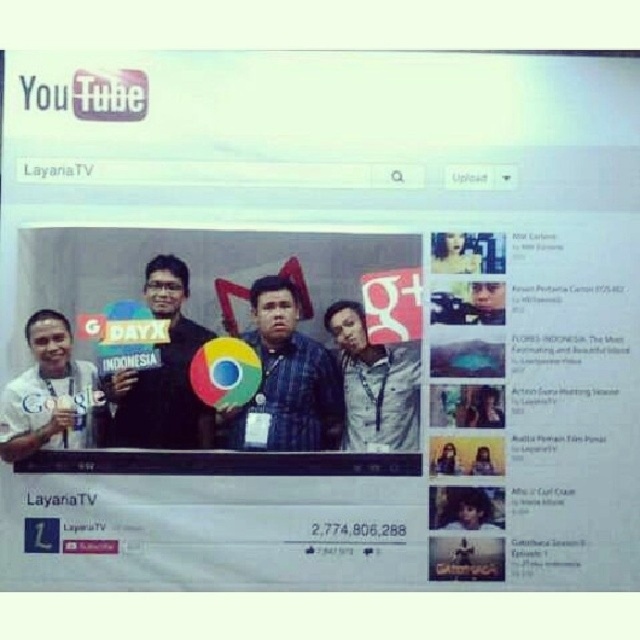
Question: Which object is closer to the camera taking this photo?

Choices:
 (A) white matte shirt at left
 (B) denim jacket at center
 (C) black matte shirt at center
 (D) matte blue shirt at center

Answer: (A)

Question: Is white matte shirt at left smaller than denim jacket at center?

Choices:
 (A) yes
 (B) no

Answer: (B)

Question: Which object is the farthest from the matte blue shirt at center?

Choices:
 (A) black matte shirt at center
 (B) denim jacket at center

Answer: (A)

Question: Can you confirm if matte blue shirt at center is positioned below white matte shirt at left?

Choices:
 (A) no
 (B) yes

Answer: (A)

Question: Can you confirm if matte blue shirt at center is positioned below black matte shirt at center?

Choices:
 (A) yes
 (B) no

Answer: (A)

Question: Which point is farther to the camera?

Choices:
 (A) matte blue shirt at center
 (B) denim jacket at center

Answer: (B)